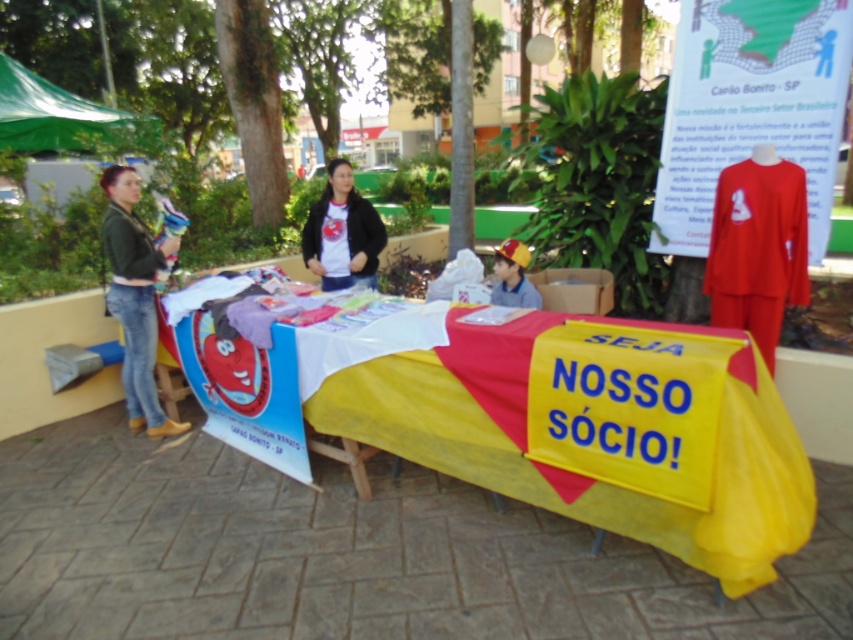
Does green fabric canopy at upper left come behind matte black jacket at center?

That is True.

Does green fabric canopy at upper left appear on the right side of matte black jacket at center?

In fact, green fabric canopy at upper left is to the left of matte black jacket at center.

Who is more forward, (62, 97) or (310, 205)?

Point (310, 205)

Identify the location of green fabric canopy at upper left. This screenshot has height=640, width=853. (62, 116).

Is the position of yellow fabric table at center less distant than that of green fabric canopy at upper left?

Yes, it is in front of green fabric canopy at upper left.

Which is above, yellow fabric table at center or green fabric canopy at upper left?

green fabric canopy at upper left is higher up.

Does point (260, 451) come closer to viewer compared to point (67, 92)?

Yes, it is in front of point (67, 92).

Where is `yellow fabric table at center`? This screenshot has width=853, height=640. yellow fabric table at center is located at coordinates (595, 429).

Who is more forward, (161, 243) or (33, 112)?

Positioned in front is point (161, 243).

Between green matte jacket at left and green fabric canopy at upper left, which one appears on the left side from the viewer's perspective?

green fabric canopy at upper left is more to the left.

This screenshot has width=853, height=640. I want to click on green matte jacket at left, so click(x=135, y=298).